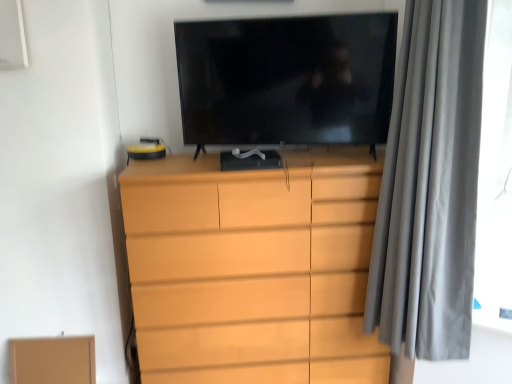
Question: Is black glossy tv at center looking in the opposite direction of gray velvet curtain at right?

Choices:
 (A) no
 (B) yes

Answer: (A)

Question: Does black glossy tv at center contain gray velvet curtain at right?

Choices:
 (A) yes
 (B) no

Answer: (B)

Question: From the image's perspective, is black glossy tv at center over gray velvet curtain at right?

Choices:
 (A) no
 (B) yes

Answer: (B)

Question: Is black glossy tv at center positioned in front of gray velvet curtain at right?

Choices:
 (A) no
 (B) yes

Answer: (A)

Question: From a real-world perspective, is black glossy tv at center under gray velvet curtain at right?

Choices:
 (A) yes
 (B) no

Answer: (B)

Question: From the image's perspective, is black glossy tv at center below gray velvet curtain at right?

Choices:
 (A) yes
 (B) no

Answer: (B)

Question: Considering the relative sizes of matte wood chest of drawers at center and brown cardboard box at lower left in the image provided, is matte wood chest of drawers at center wider than brown cardboard box at lower left?

Choices:
 (A) no
 (B) yes

Answer: (B)

Question: From the image's perspective, would you say matte wood chest of drawers at center is shown under brown cardboard box at lower left?

Choices:
 (A) yes
 (B) no

Answer: (B)

Question: Can you confirm if matte wood chest of drawers at center is taller than brown cardboard box at lower left?

Choices:
 (A) yes
 (B) no

Answer: (A)

Question: From a real-world perspective, is matte wood chest of drawers at center beneath brown cardboard box at lower left?

Choices:
 (A) yes
 (B) no

Answer: (B)

Question: Would you say matte wood chest of drawers at center is a long distance from brown cardboard box at lower left?

Choices:
 (A) yes
 (B) no

Answer: (B)

Question: Is matte wood chest of drawers at center outside of brown cardboard box at lower left?

Choices:
 (A) yes
 (B) no

Answer: (A)

Question: From a real-world perspective, is matte wood chest of drawers at center positioned under black glossy tv at center based on gravity?

Choices:
 (A) yes
 (B) no

Answer: (A)